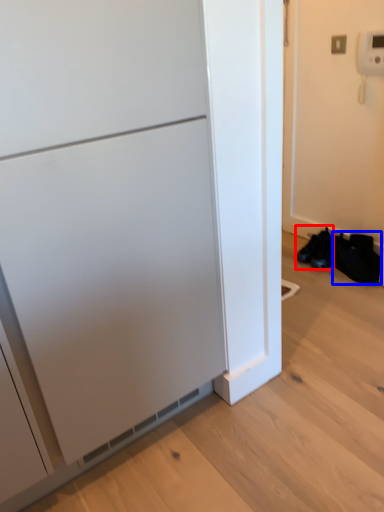
Question: Which point is further to the camera, footwear (highlighted by a red box) or shoe (highlighted by a blue box)?

Choices:
 (A) footwear
 (B) shoe

Answer: (A)